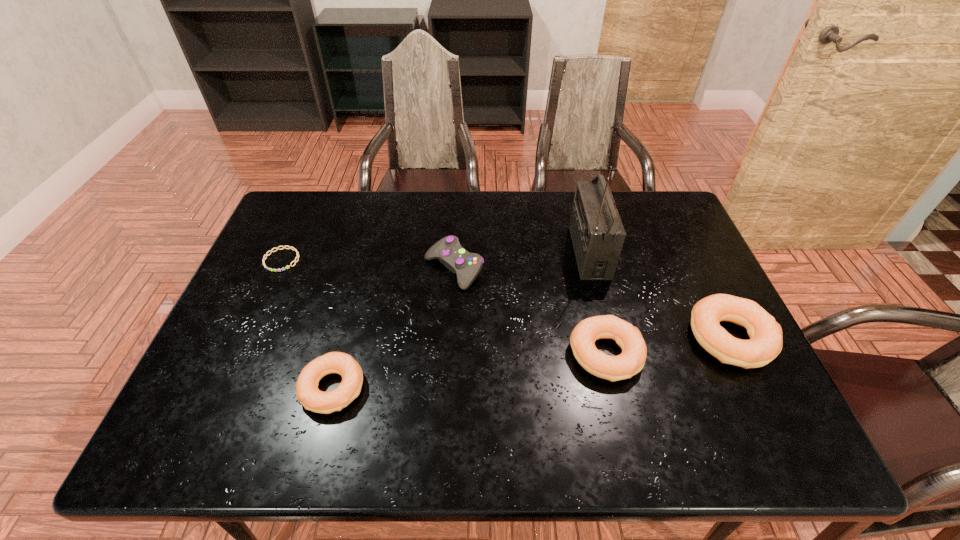
To achieve even spacing by inserting another bagel among them, please point to a vacant spot for this new bagel. Please provide its 2D coordinates. Your answer should be formatted as a tuple, i.e. [(x, y)], where the tuple contains the x and y coordinates of a point satisfying the conditions above.

[(473, 370)]